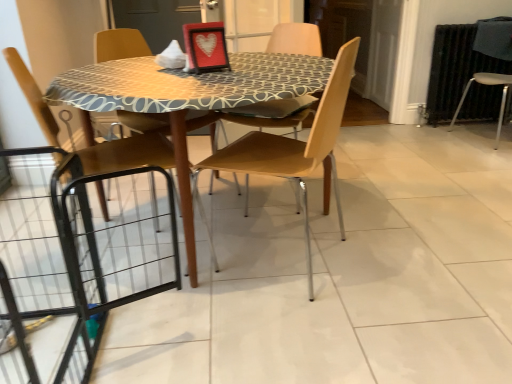
Question: From a real-world perspective, is transparent glass screen door at center physically below black metal radiator at right?

Choices:
 (A) yes
 (B) no

Answer: (B)

Question: Is transparent glass screen door at center wider than black metal radiator at right?

Choices:
 (A) yes
 (B) no

Answer: (A)

Question: Are transparent glass screen door at center and black metal radiator at right far apart?

Choices:
 (A) yes
 (B) no

Answer: (B)

Question: Does transparent glass screen door at center turn towards black metal radiator at right?

Choices:
 (A) no
 (B) yes

Answer: (A)

Question: From the image's perspective, is transparent glass screen door at center beneath black metal radiator at right?

Choices:
 (A) yes
 (B) no

Answer: (B)

Question: Is light brown wood chair at center, which is the third chair in left-to-right order, wider or thinner than matte black picture frame at center?

Choices:
 (A) wide
 (B) thin

Answer: (A)

Question: In terms of height, does light brown wood chair at center, which is the third chair in left-to-right order, look taller or shorter compared to matte black picture frame at center?

Choices:
 (A) tall
 (B) short

Answer: (A)

Question: From a real-world perspective, is light brown wood chair at center, which is the third chair in left-to-right order, physically located above or below matte black picture frame at center?

Choices:
 (A) below
 (B) above

Answer: (A)

Question: In the image, is light brown wood chair at center, which is the third chair in left-to-right order, on the left side or the right side of matte black picture frame at center?

Choices:
 (A) right
 (B) left

Answer: (A)

Question: From a real-world perspective, relative to wooden chair at center, the second chair positioned from the left, is matte black picture frame at center vertically above or below?

Choices:
 (A) below
 (B) above

Answer: (B)

Question: From their relative heights in the image, would you say matte black picture frame at center is taller or shorter than wooden chair at center, the 2th chair positioned from the right?

Choices:
 (A) tall
 (B) short

Answer: (B)

Question: In the image, is matte black picture frame at center on the left side or the right side of wooden chair at center, the second chair positioned from the left?

Choices:
 (A) right
 (B) left

Answer: (B)

Question: In terms of width, does matte black picture frame at center look wider or thinner when compared to wooden chair at center, the second chair positioned from the left?

Choices:
 (A) thin
 (B) wide

Answer: (A)

Question: Choose the correct answer: Is transparent glass screen door at center inside light brown wood chair at center, which is the third chair in left-to-right order, or outside it?

Choices:
 (A) outside
 (B) inside

Answer: (A)

Question: Is transparent glass screen door at center bigger or smaller than light brown wood chair at center, which is the third chair in left-to-right order?

Choices:
 (A) small
 (B) big

Answer: (A)